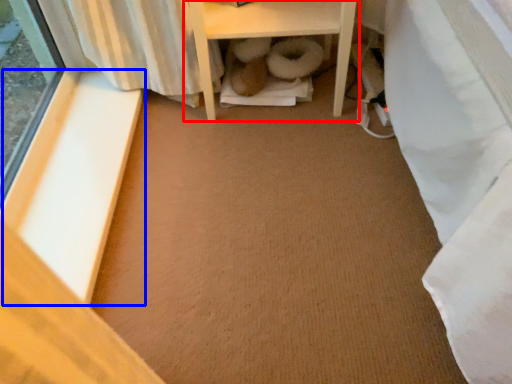
Question: Which of the following is the closest to the observer, furniture (highlighted by a red box) or window sill (highlighted by a blue box)?

Choices:
 (A) furniture
 (B) window sill

Answer: (B)